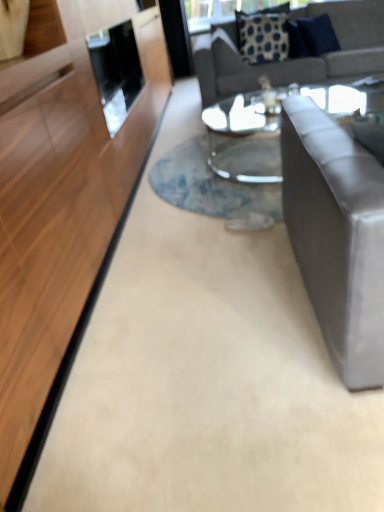
Question: Is clear glass coffee table at center completely or partially outside of gray fabric couch at upper right, which appears as the second studio couch when viewed from the front?

Choices:
 (A) yes
 (B) no

Answer: (A)

Question: Can you confirm if clear glass coffee table at center is positioned to the right of gray fabric couch at upper right, which appears as the second studio couch when viewed from the front?

Choices:
 (A) yes
 (B) no

Answer: (B)

Question: From the image's perspective, is clear glass coffee table at center over gray fabric couch at upper right, the second studio couch ordered from the bottom?

Choices:
 (A) yes
 (B) no

Answer: (B)

Question: From a real-world perspective, is clear glass coffee table at center located beneath gray fabric couch at upper right, the second studio couch ordered from the bottom?

Choices:
 (A) yes
 (B) no

Answer: (A)

Question: Is clear glass coffee table at center positioned before gray fabric couch at upper right, the first studio couch when ordered from back to front?

Choices:
 (A) yes
 (B) no

Answer: (A)

Question: Could you tell me if clear glass coffee table at center is turned towards gray fabric couch at upper right, which appears as the second studio couch when viewed from the front?

Choices:
 (A) no
 (B) yes

Answer: (A)

Question: Is the position of blue fabric pillow at upper right, which is the 2th pillow from left to right, more distant than that of blue dotted fabric pillow at upper center, the second pillow in the right-to-left sequence?

Choices:
 (A) yes
 (B) no

Answer: (B)

Question: Is the depth of blue fabric pillow at upper right, positioned as the 1th pillow in right-to-left order, less than that of blue dotted fabric pillow at upper center, the second pillow in the right-to-left sequence?

Choices:
 (A) yes
 (B) no

Answer: (A)

Question: Is blue fabric pillow at upper right, positioned as the 1th pillow in right-to-left order, turned away from blue dotted fabric pillow at upper center, the 1th pillow in the left-to-right sequence?

Choices:
 (A) yes
 (B) no

Answer: (B)

Question: Considering the relative sizes of blue fabric pillow at upper right, which is the 2th pillow from left to right, and blue dotted fabric pillow at upper center, the 1th pillow in the left-to-right sequence, in the image provided, is blue fabric pillow at upper right, which is the 2th pillow from left to right, wider than blue dotted fabric pillow at upper center, the 1th pillow in the left-to-right sequence,?

Choices:
 (A) no
 (B) yes

Answer: (B)

Question: Considering the relative sizes of blue fabric pillow at upper right, positioned as the 1th pillow in right-to-left order, and blue dotted fabric pillow at upper center, the second pillow in the right-to-left sequence, in the image provided, is blue fabric pillow at upper right, positioned as the 1th pillow in right-to-left order, bigger than blue dotted fabric pillow at upper center, the second pillow in the right-to-left sequence,?

Choices:
 (A) yes
 (B) no

Answer: (B)

Question: Is blue dotted fabric pillow at upper center, the second pillow in the right-to-left sequence, located within blue fabric pillow at upper right, positioned as the 1th pillow in right-to-left order?

Choices:
 (A) no
 (B) yes

Answer: (A)

Question: Does satin gray couch at right, acting as the 1th studio couch starting from the front, have a greater height compared to blue dotted fabric pillow at upper center, the 1th pillow in the left-to-right sequence?

Choices:
 (A) no
 (B) yes

Answer: (B)